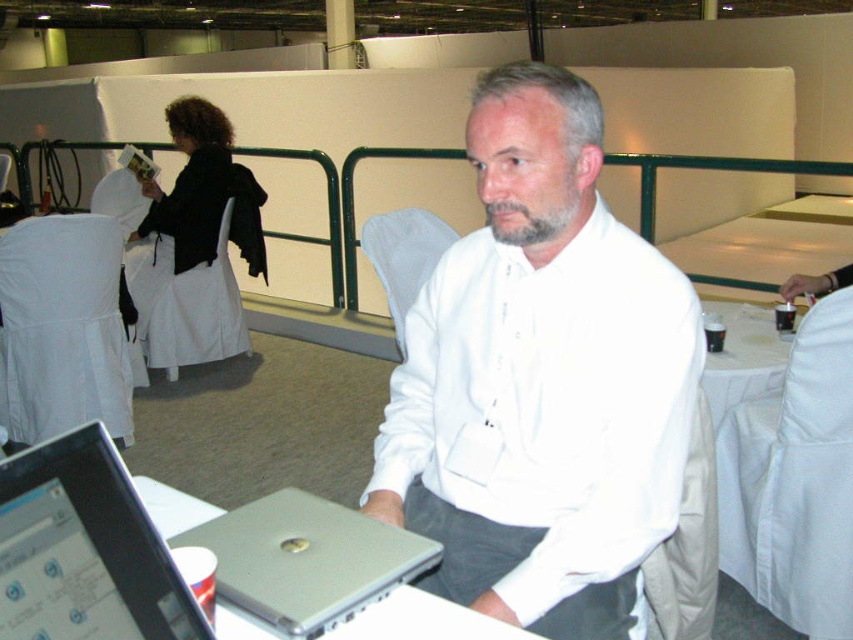
Question: Which object is positioned farthest from the white cloth at right?

Choices:
 (A) silver metallic laptop at lower center
 (B) silver metallic laptop at lower left

Answer: (A)

Question: Does silver metallic laptop at lower left appear under white cloth at right?

Choices:
 (A) yes
 (B) no

Answer: (A)

Question: Can you confirm if white matte shirt at center is thinner than silver metallic laptop at lower center?

Choices:
 (A) yes
 (B) no

Answer: (B)

Question: Which point appears closest to the camera in this image?

Choices:
 (A) (735, 388)
 (B) (294, 493)
 (C) (138, 588)

Answer: (C)

Question: Does white matte shirt at center have a lesser width compared to silver metallic laptop at lower left?

Choices:
 (A) yes
 (B) no

Answer: (B)

Question: Estimate the real-world distances between objects in this image. Which object is farther from the white matte shirt at center?

Choices:
 (A) silver metallic laptop at lower left
 (B) silver metallic laptop at lower center

Answer: (B)